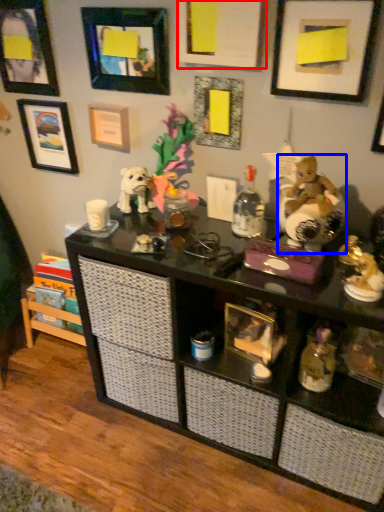
Question: Among these objects, which one is nearest to the camera, picture frame (highlighted by a red box) or toy (highlighted by a blue box)?

Choices:
 (A) picture frame
 (B) toy

Answer: (B)